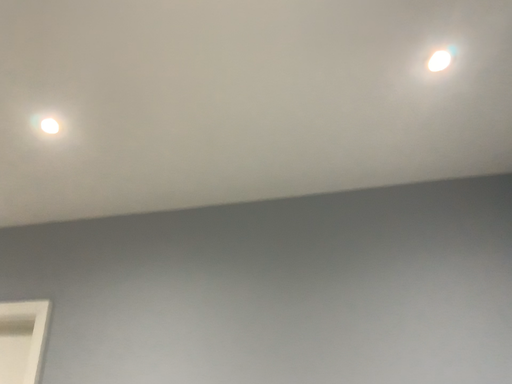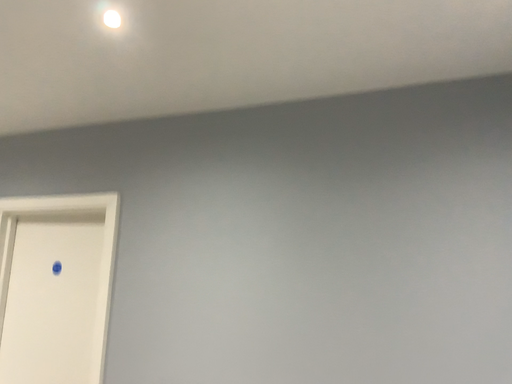
Question: How did the camera likely rotate when shooting the video?

Choices:
 (A) rotated upward
 (B) rotated downward

Answer: (B)